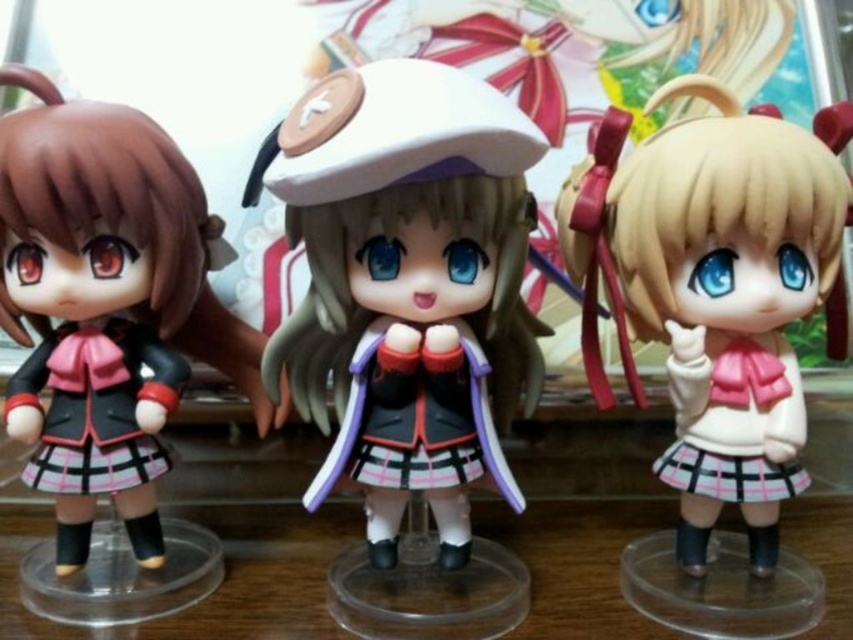
Based on the photo, you are a collector who wants to place a new figurine on the table. Based on the current setup, can you place the new figurine on the transparent plastic table at center without moving the satin white beret at center?

The satin white beret at center is located above transparent plastic table at center, so placing the new figurine on the transparent plastic table at center would require moving the beret first.

You are trying to place a small decoration on the transparent plastic table at center. Can the satin white beret at center fit on it without falling over?

The satin white beret at center is much taller as transparent plastic table at center, so it might not fit properly on the table without toppling over.